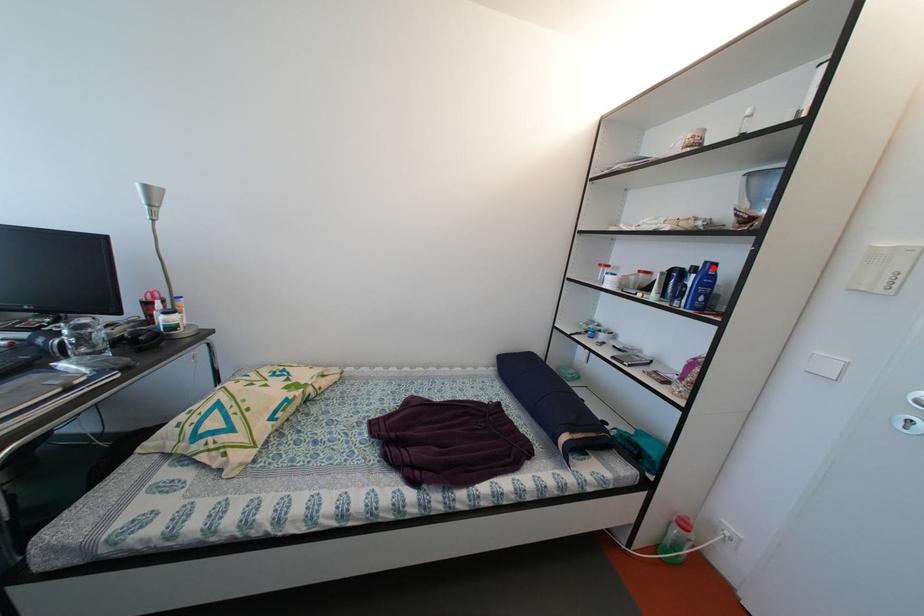
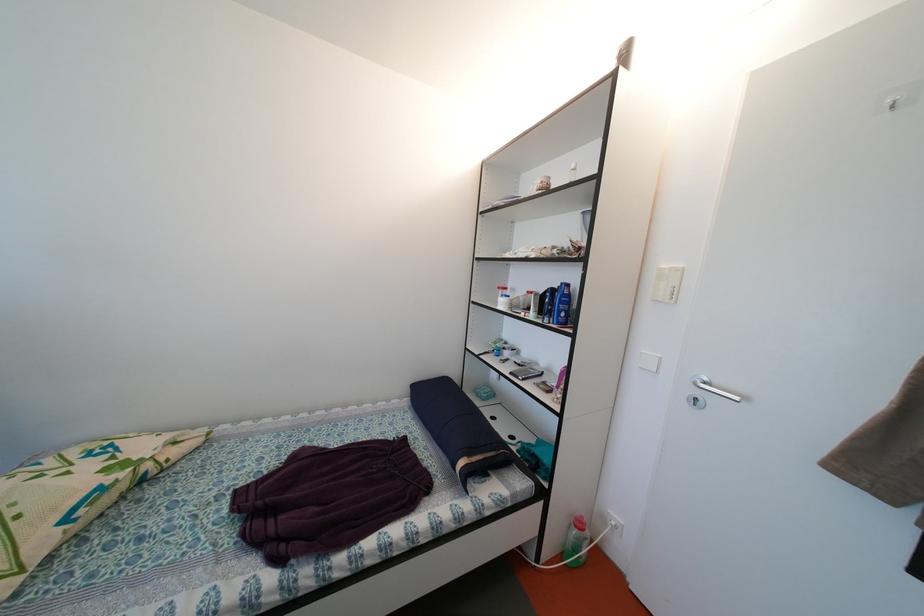
Locate, in the second image, the point that corresponds to the highlighted location in the first image.

(569, 289)